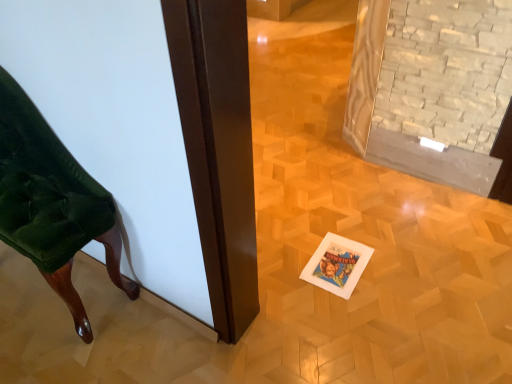
The height and width of the screenshot is (384, 512). I want to click on vacant area on top of white paper postcard at center (from a real-world perspective), so click(335, 261).